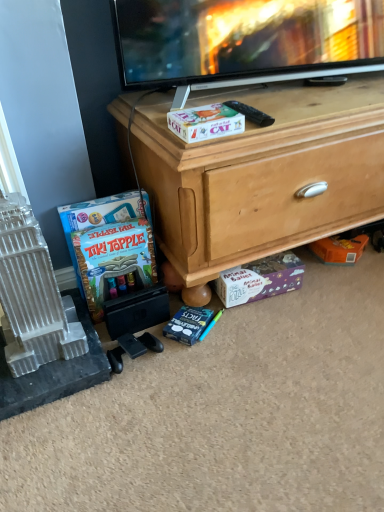
This screenshot has height=512, width=384. What do you see at coordinates (113, 259) in the screenshot?
I see `matte board game at lower left` at bounding box center [113, 259].

In order to face matte board game at lower left, should I rotate leftwards or rightwards?

You should rotate left by 9.452 degrees.

This screenshot has height=512, width=384. Describe the element at coordinates (260, 279) in the screenshot. I see `purple cardboard puzzle box at lower center` at that location.

At what (x,y) coordinates should I click in order to perform the action: click on wooden chest at center. Please return your answer as a coordinate pair (x, y). This screenshot has height=512, width=384. Looking at the image, I should click on (261, 176).

Where is `white cardboard box at center`? white cardboard box at center is located at coordinates (205, 122).

In the scene shown: How far apart are white plastic building at left and white cardboard box at center?

white plastic building at left and white cardboard box at center are 19.39 inches apart from each other.

Which of these two, white plastic building at left or white cardboard box at center, is wider?

white plastic building at left is wider.

Considering their positions, is white plastic building at left located in front of or behind white cardboard box at center?

Visually, white plastic building at left is located in front of white cardboard box at center.

Are white plastic building at left and white cardboard box at center beside each other?

No, white plastic building at left is not with white cardboard box at center.

From the image's perspective, is white plastic building at left positioned above or below wooden chest at center?

Based on their image positions, white plastic building at left is located beneath wooden chest at center.

Is white plastic building at left placed right next to wooden chest at center?

No, white plastic building at left is not next to wooden chest at center.

Where is `desk that appears behind the white plastic building at left`? This screenshot has height=512, width=384. desk that appears behind the white plastic building at left is located at coordinates [261, 176].

From a real-world perspective, relative to white cardboard box at center, is black plastic remote control at upper center vertically above or below?

Clearly, from a real-world perspective, black plastic remote control at upper center is below white cardboard box at center.

Is black plastic remote control at upper center oriented away from white cardboard box at center?

That's not correct — black plastic remote control at upper center is not looking away from white cardboard box at center.

Does point (265, 123) come behind point (192, 129)?

Yes.

Considering the relative sizes of black plastic remote control at upper center and white cardboard box at center in the image provided, is black plastic remote control at upper center smaller than white cardboard box at center?

Indeed, black plastic remote control at upper center has a smaller size compared to white cardboard box at center.

Between white cardboard box at center and matte board game at lower left, which one appears on the right side from the viewer's perspective?

white cardboard box at center is more to the right.

Is white cardboard box at center facing towards matte board game at lower left?

No, white cardboard box at center is not aimed at matte board game at lower left.

This screenshot has height=512, width=384. Identify the location of comic book below the white cardboard box at center (from a real-world perspective). (113, 259).

From a real-world perspective, which is physically below, white cardboard box at center or purple cardboard puzzle box at lower center?

purple cardboard puzzle box at lower center.

Considering the relative positions of white cardboard box at center and purple cardboard puzzle box at lower center in the image provided, is white cardboard box at center to the left of purple cardboard puzzle box at lower center from the viewer's perspective?

Yes.

Is white cardboard box at center taller than purple cardboard puzzle box at lower center?

No.

Between white cardboard box at center and purple cardboard puzzle box at lower center, which one has larger width?

With larger width is white cardboard box at center.

Is black plastic remote control at upper center directly adjacent to wooden chest at center?

black plastic remote control at upper center is not next to wooden chest at center, and they're not touching.

Considering their positions, is black plastic remote control at upper center located in front of or behind wooden chest at center?

In the image, black plastic remote control at upper center appears behind wooden chest at center.

Is black plastic remote control at upper center to the right of wooden chest at center from the viewer's perspective?

In fact, black plastic remote control at upper center is to the left of wooden chest at center.

Is black plastic remote control at upper center taller than wooden chest at center?

No, black plastic remote control at upper center is not taller than wooden chest at center.

Which object is positioned more to the left, purple cardboard puzzle box at lower center or black plastic remote control at upper center?

black plastic remote control at upper center.

Does point (236, 288) come closer to viewer compared to point (249, 111)?

No, (236, 288) is further to viewer.

In terms of height, does purple cardboard puzzle box at lower center look taller or shorter compared to black plastic remote control at upper center?

purple cardboard puzzle box at lower center is taller than black plastic remote control at upper center.

Consider the image. Is purple cardboard puzzle box at lower center inside or outside of black plastic remote control at upper center?

purple cardboard puzzle box at lower center is outside black plastic remote control at upper center.

Identify the location of toy that is under the white cardboard box at center (from a real-world perspective). (32, 294).

Identify the location of desk behind the white plastic building at left. (261, 176).

From the picture: Based on their spatial positions, is white cardboard box at center or black plastic remote control at upper center closer to wooden chest at center?

white cardboard box at center is closer to wooden chest at center.

Estimate the real-world distances between objects in this image. Which object is closer to white plastic building at left, matte board game at lower left or purple cardboard puzzle box at lower center?

matte board game at lower left is positioned closer to the anchor white plastic building at left.

Which object lies nearer to the anchor point matte board game at lower left, black plastic remote control at upper center or wooden chest at center?

wooden chest at center lies closer to matte board game at lower left than the other object.

Looking at the image, which one is located closer to white cardboard box at center, white plastic building at left or purple cardboard puzzle box at lower center?

The object closer to white cardboard box at center is purple cardboard puzzle box at lower center.

When comparing their distances from matte board game at lower left, does black plastic remote control at upper center or white cardboard box at center seem closer?

white cardboard box at center is positioned closer to the anchor matte board game at lower left.

Considering their positions, is purple cardboard puzzle box at lower center positioned further to black plastic remote control at upper center than white cardboard box at center?

purple cardboard puzzle box at lower center.

Which object lies nearer to the anchor point purple cardboard puzzle box at lower center, black plastic remote control at upper center or wooden chest at center?

wooden chest at center.

Which object lies further to the anchor point white cardboard box at center, purple cardboard puzzle box at lower center or white plastic building at left?

Based on the image, white plastic building at left appears to be further to white cardboard box at center.

Locate an element on the screen. comic book between white plastic building at left and purple cardboard puzzle box at lower center is located at coordinates (113, 259).

Locate an element on the screen. The height and width of the screenshot is (512, 384). desk between black plastic remote control at upper center and purple cardboard puzzle box at lower center in the up-down direction is located at coordinates (261, 176).

Where is `remote control between white plastic building at left and purple cardboard puzzle box at lower center`? remote control between white plastic building at left and purple cardboard puzzle box at lower center is located at coordinates (251, 113).

The width and height of the screenshot is (384, 512). Find the location of `box between white plastic building at left and purple cardboard puzzle box at lower center`. box between white plastic building at left and purple cardboard puzzle box at lower center is located at coordinates (205, 122).